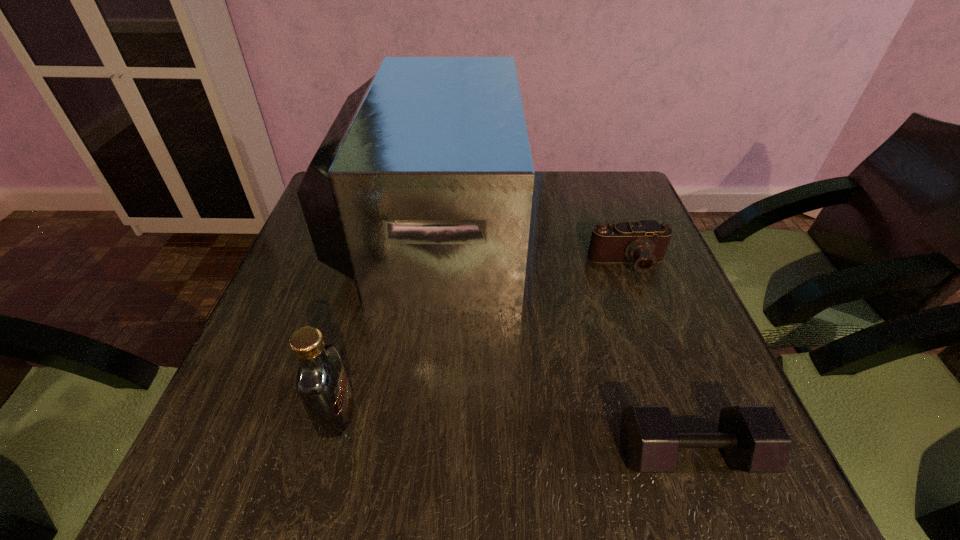
The image size is (960, 540). Identify the location of object that is at the left edge. [421, 192].

Find the location of a particular element. dumbbell that is positioned at the right edge is located at coordinates (753, 439).

Image resolution: width=960 pixels, height=540 pixels. I want to click on camera present at the right edge, so (644, 242).

This screenshot has height=540, width=960. I want to click on object at the far left corner, so click(421, 192).

Locate an element on the screen. object at the near right corner is located at coordinates (753, 439).

Locate an element on the screen. This screenshot has height=540, width=960. free region at the far edge is located at coordinates (580, 205).

This screenshot has height=540, width=960. Identify the location of vacant space at the near edge of the desktop. (611, 463).

Identify the location of vacant space at the left edge of the desktop. The height and width of the screenshot is (540, 960). (301, 301).

This screenshot has height=540, width=960. I want to click on vacant region at the right edge of the desktop, so click(x=639, y=377).

Identify the location of vacant space at the far right corner. The image size is (960, 540). (613, 182).